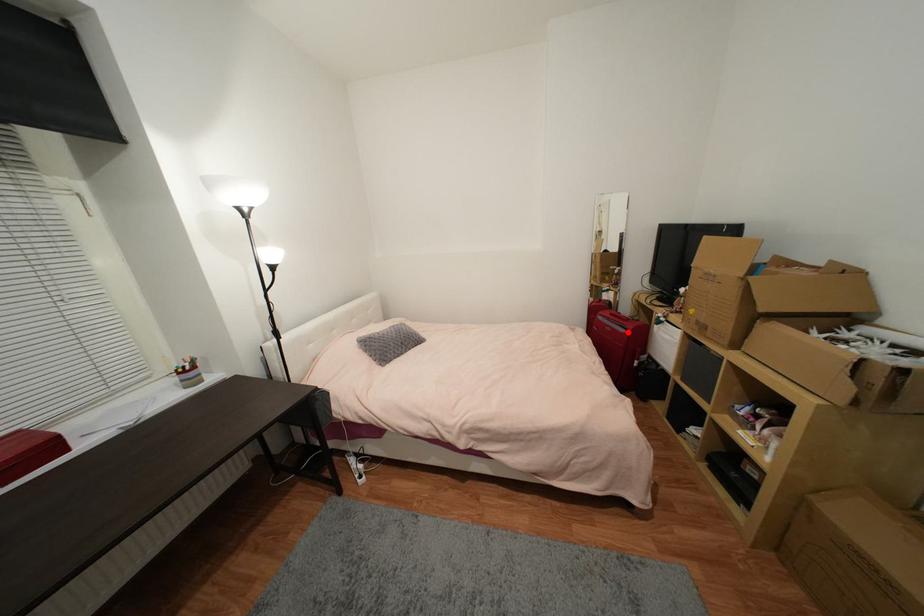
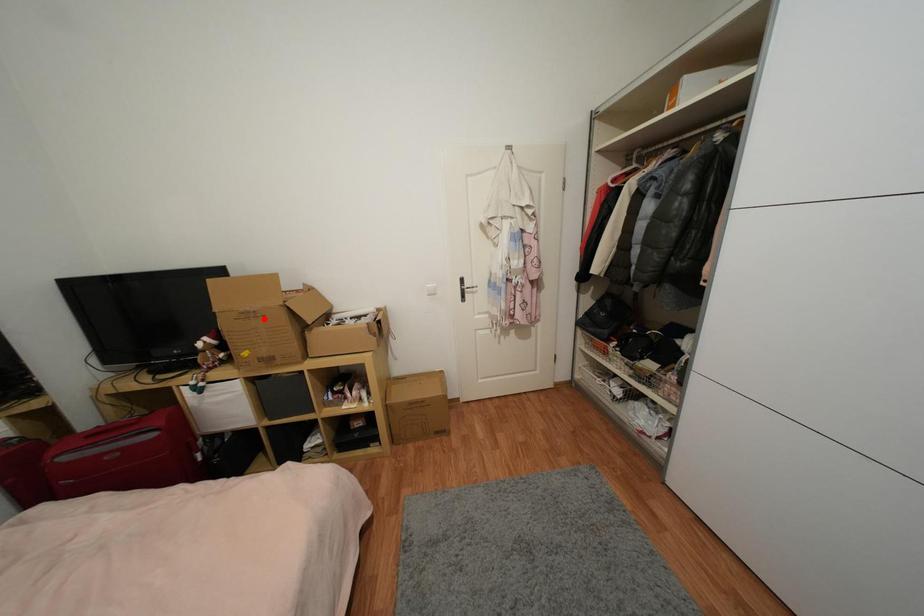
I am providing you with two images of the same scene from different viewpoints. A red point is marked on the first image and another point is marked on the second image. Are the points marked in image1 and image2 representing the same 3D position?

No